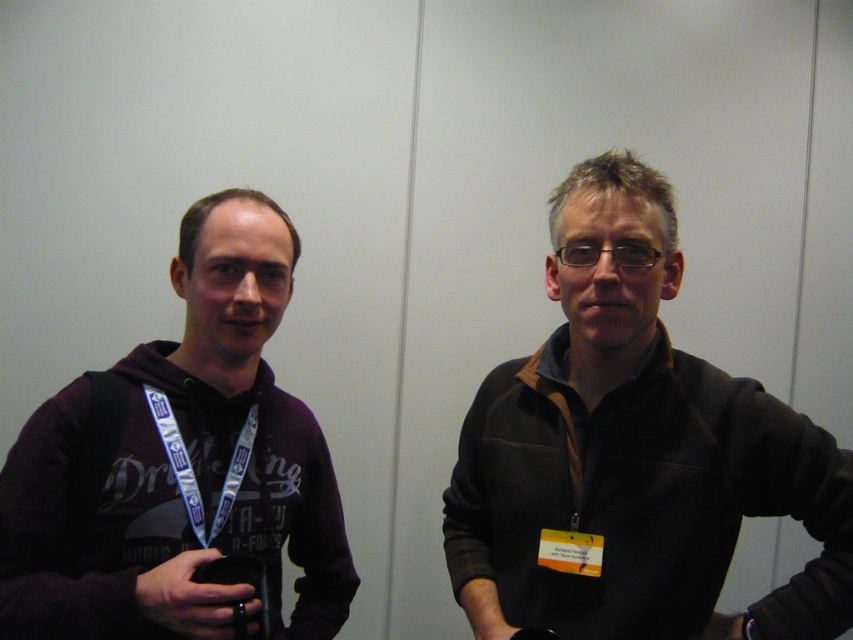
You are standing in a room and see a point at coordinates (682, 429). If you want to place a 1.0 meter long object from your current position to that point, will it reach?

The distance between you and the point at coordinates (682, 429) is 1.10 meters. Since the object is 1.0 meters long, it will not quite reach the point as it is 0.10 meters shorter than needed.

You are organizing a clothing donation drive and need to determine if the dark brown fleece at right and the matte black hoodie at left can fit into a standard donation box that measures 30x30x30 cm. Given their sizes, which one is more likely to fit comfortably?

The matte black hoodie at left is smaller in size than the dark brown fleece at right, so it is more likely to fit comfortably into the standard donation box.

You are a photographer setting up for a group photo. You have a camera with a focal length of 50mm and want to ensure the dark brown fleece at right is in focus. If the minimum focusing distance of your camera is 39 inches, will you need to adjust your position?

The dark brown fleece at right is 39.35 inches away from the camera. Since the minimum focusing distance is 39 inches, the camera can focus on the dark brown fleece at right as it is just slightly beyond the minimum distance.